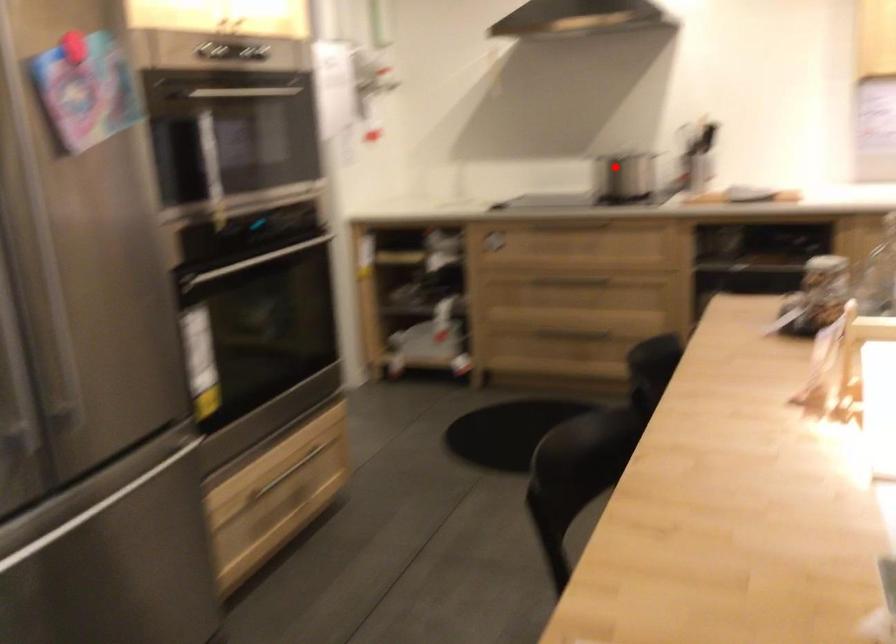
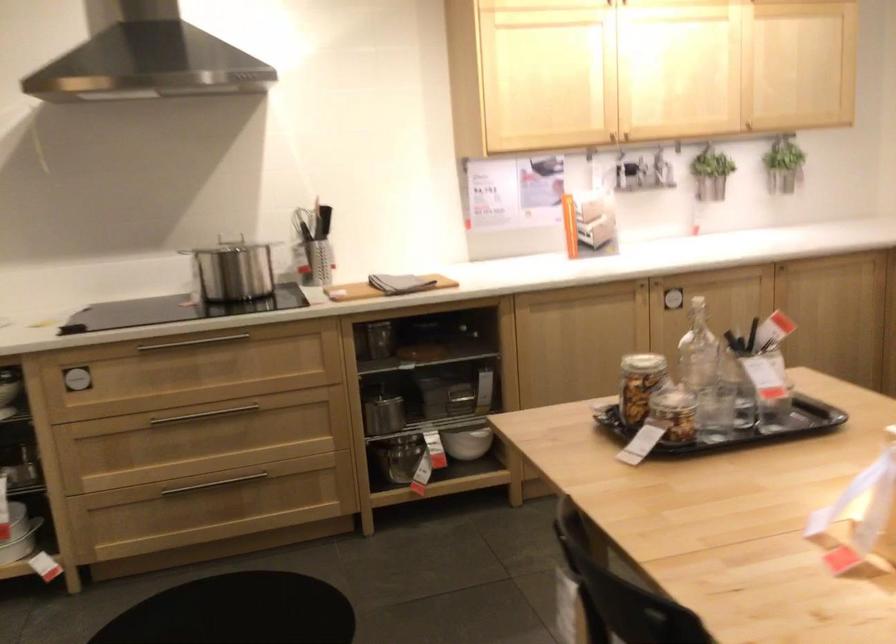
Question: I am providing you with two images of the same scene from different viewpoints. A red point is marked on the first image. Is the red point's position out of view in image 2?

Choices:
 (A) Yes
 (B) No

Answer: (B)